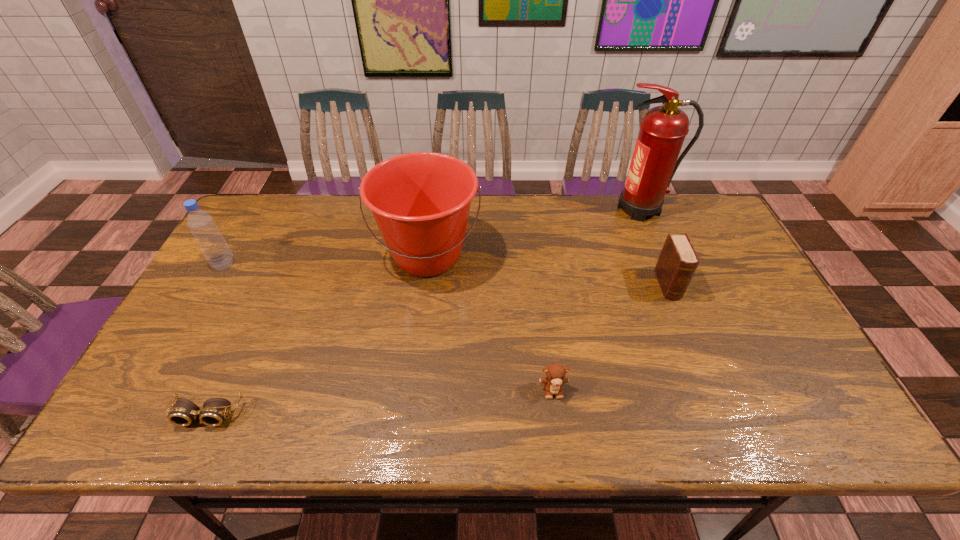
Locate an element on the screen. bottle that is positioned at the left edge is located at coordinates (201, 224).

At what (x,y) coordinates should I click in order to perform the action: click on goggles situated at the left edge. Please return your answer as a coordinate pair (x, y). This screenshot has height=540, width=960. Looking at the image, I should click on (183, 413).

The height and width of the screenshot is (540, 960). In order to click on object that is at the right edge in this screenshot , I will do `click(663, 129)`.

This screenshot has height=540, width=960. I want to click on object located in the near left corner section of the desktop, so click(183, 413).

At what (x,y) coordinates should I click in order to perform the action: click on object present at the far right corner. Please return your answer as a coordinate pair (x, y). Looking at the image, I should click on (663, 129).

Where is `free space at the far edge of the desktop`? This screenshot has height=540, width=960. free space at the far edge of the desktop is located at coordinates (479, 237).

Locate an element on the screen. free space at the near edge of the desktop is located at coordinates (756, 433).

Find the location of a particular element. blank space at the left edge is located at coordinates (212, 323).

Image resolution: width=960 pixels, height=540 pixels. In the image, there is a desktop. In order to click on vacant space at the far left corner in this screenshot , I will do `click(264, 207)`.

Locate an element on the screen. Image resolution: width=960 pixels, height=540 pixels. vacant region at the near left corner is located at coordinates (143, 413).